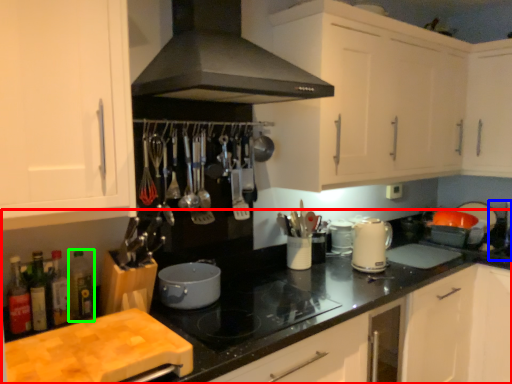
Question: Considering the real-world distances, which object is closest to cabinetry (highlighted by a red box)? sink (highlighted by a blue box) or bottle (highlighted by a green box).

Choices:
 (A) sink
 (B) bottle

Answer: (B)